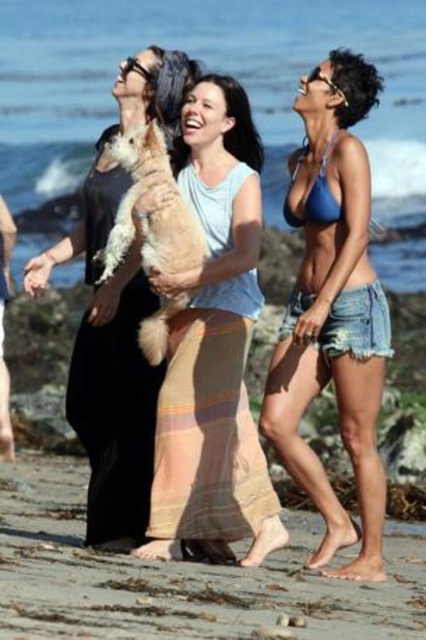
Question: Which object appears closest to the camera in this image?

Choices:
 (A) smooth sand at lower center
 (B) matte beige skirt at center
 (C) black fabric dress at center

Answer: (A)

Question: Can you confirm if smooth sand at lower center is thinner than blue denim shorts at center?

Choices:
 (A) yes
 (B) no

Answer: (B)

Question: Considering the real-world distances, which object is farthest from the smooth sand at lower center?

Choices:
 (A) blue denim shorts at center
 (B) matte beige skirt at center

Answer: (A)

Question: Does smooth sand at lower center appear on the left side of blue denim shorts at center?

Choices:
 (A) no
 (B) yes

Answer: (B)

Question: Is matte beige skirt at center below white fluffy dog at center?

Choices:
 (A) yes
 (B) no

Answer: (A)

Question: Which of these objects is positioned farthest from the matte beige skirt at center?

Choices:
 (A) black fabric dress at center
 (B) white fluffy dog at center

Answer: (A)